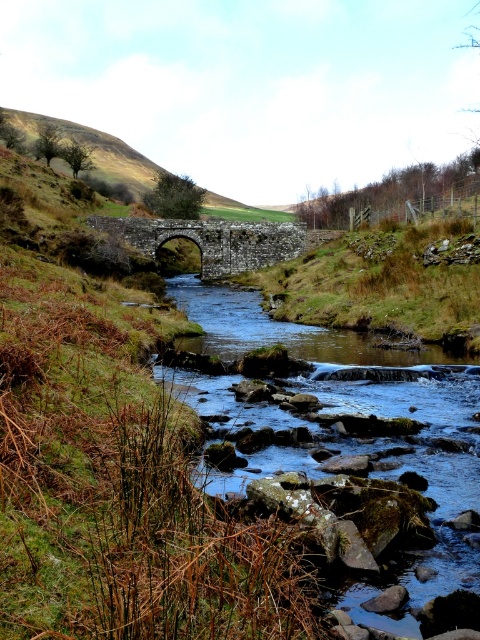
Can you confirm if clear water at center is bigger than stone arch bridge at center?

Yes.

Does clear water at center have a lesser height compared to stone arch bridge at center?

No, clear water at center is not shorter than stone arch bridge at center.

The height and width of the screenshot is (640, 480). Describe the element at coordinates (365, 410) in the screenshot. I see `clear water at center` at that location.

What are the coordinates of `clear water at center` in the screenshot? It's located at click(x=365, y=410).